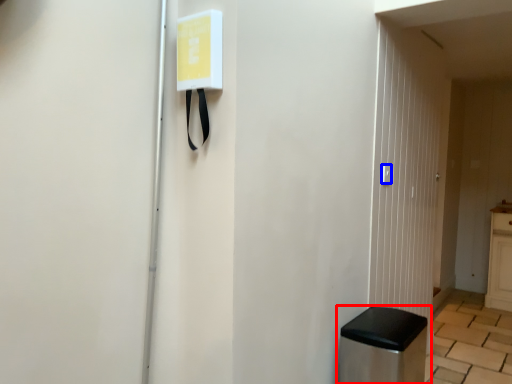
Question: Which point is further to the camera, furniture (highlighted by a red box) or light switch (highlighted by a blue box)?

Choices:
 (A) furniture
 (B) light switch

Answer: (B)